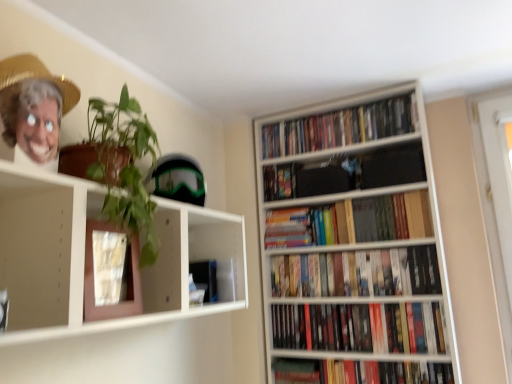
Question: Can you confirm if wooden bookshelf at right is wider than multicolored paperbacks at upper right, placed as the first book when sorted from top to bottom?

Choices:
 (A) no
 (B) yes

Answer: (B)

Question: Is wooden bookshelf at right facing away from multicolored paperbacks at upper right, placed as the first book when sorted from top to bottom?

Choices:
 (A) yes
 (B) no

Answer: (A)

Question: Is wooden bookshelf at right facing towards multicolored paperbacks at upper right, which appears as the 7th book when ordered from the bottom?

Choices:
 (A) yes
 (B) no

Answer: (A)

Question: Considering the relative sizes of wooden bookshelf at right and multicolored paperbacks at upper right, which appears as the 7th book when ordered from the bottom, in the image provided, is wooden bookshelf at right shorter than multicolored paperbacks at upper right, which appears as the 7th book when ordered from the bottom,?

Choices:
 (A) yes
 (B) no

Answer: (B)

Question: From a real-world perspective, is wooden bookshelf at right under multicolored paperbacks at upper right, which appears as the 7th book when ordered from the bottom?

Choices:
 (A) yes
 (B) no

Answer: (A)

Question: From a real-world perspective, is green matte plant at upper left positioned above or below green leafy plant at upper left?

Choices:
 (A) below
 (B) above

Answer: (A)

Question: Considering the positions of green matte plant at upper left and green leafy plant at upper left in the image, is green matte plant at upper left wider or thinner than green leafy plant at upper left?

Choices:
 (A) thin
 (B) wide

Answer: (A)

Question: Based on their sizes in the image, would you say green matte plant at upper left is bigger or smaller than green leafy plant at upper left?

Choices:
 (A) big
 (B) small

Answer: (A)

Question: Relative to green leafy plant at upper left, is green matte plant at upper left in front or behind?

Choices:
 (A) behind
 (B) front

Answer: (B)

Question: In the image, is wooden bookshelf at right positioned in front of or behind hardcover books at center, the 5th book viewed from the top?

Choices:
 (A) front
 (B) behind

Answer: (A)

Question: Considering the relative positions of wooden bookshelf at right and hardcover books at center, the 3th book when ordered from bottom to top, in the image provided, is wooden bookshelf at right to the left or to the right of hardcover books at center, the 3th book when ordered from bottom to top,?

Choices:
 (A) right
 (B) left

Answer: (A)

Question: From a real-world perspective, relative to hardcover books at center, the 3th book when ordered from bottom to top, is wooden bookshelf at right vertically above or below?

Choices:
 (A) above
 (B) below

Answer: (A)

Question: Considering the positions of wooden bookshelf at right and hardcover books at center, the 5th book viewed from the top, in the image, is wooden bookshelf at right wider or thinner than hardcover books at center, the 5th book viewed from the top,?

Choices:
 (A) wide
 (B) thin

Answer: (A)

Question: Does point (282, 180) appear closer or farther from the camera than point (323, 382)?

Choices:
 (A) closer
 (B) farther

Answer: (B)

Question: From the image's perspective, is multicolored plastic toy at upper center, the 6th book positioned from the bottom, located above or below hardcover book at lower right, the first book in the bottom-to-top sequence?

Choices:
 (A) below
 (B) above

Answer: (B)